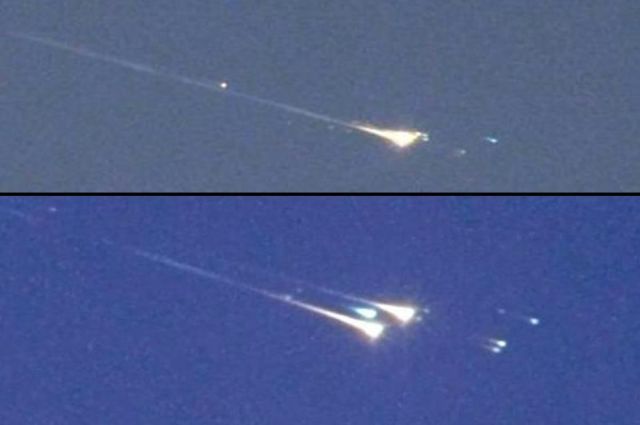
Find the location of a particular element. The height and width of the screenshot is (425, 640). 3 small lights in bottom image is located at coordinates (496, 352), (496, 347), (536, 317).